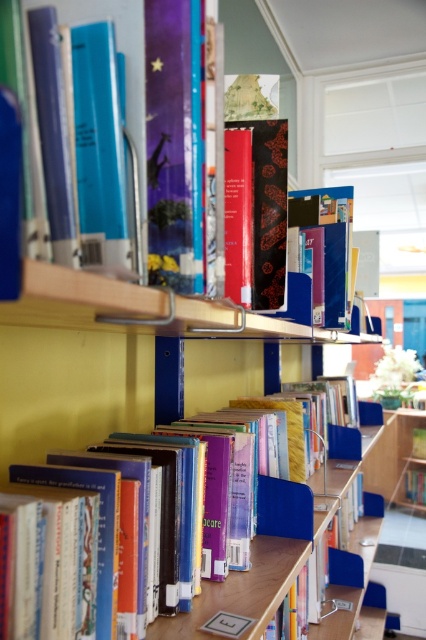
Question: Is the position of hardcover book at center more distant than that of matte black book at center?

Choices:
 (A) no
 (B) yes

Answer: (A)

Question: Which point is farther to the camera?

Choices:
 (A) hardcover book at center
 (B) matte blue book at center
 (C) matte black book at center

Answer: (B)

Question: Where is matte black book at center located in relation to matte blue book at center in the image?

Choices:
 (A) below
 (B) above

Answer: (A)

Question: Which point appears farthest from the camera in this image?

Choices:
 (A) (339, 316)
 (B) (236, 536)

Answer: (A)

Question: Which point is farther to the camera?

Choices:
 (A) matte blue book at center
 (B) hardcover book at center

Answer: (A)

Question: Is hardcover book at center bigger than matte black book at center?

Choices:
 (A) no
 (B) yes

Answer: (B)